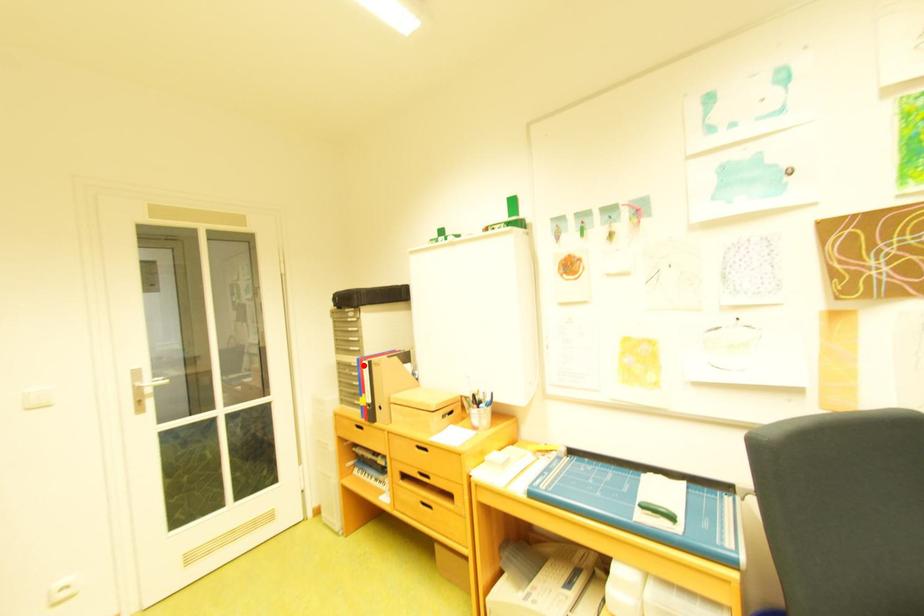
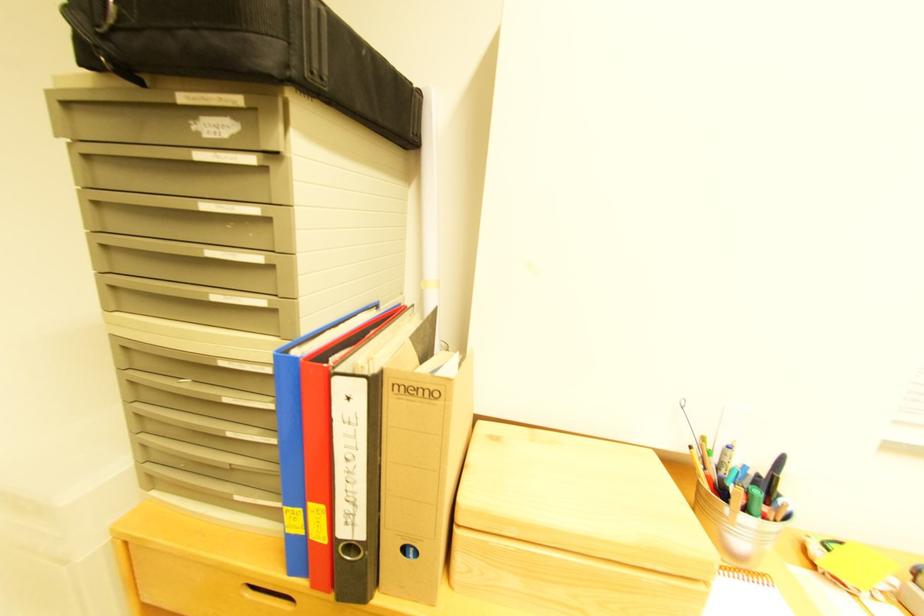
Where in the second image is the point corresponding to the highlighted location from the first image?

(235, 363)